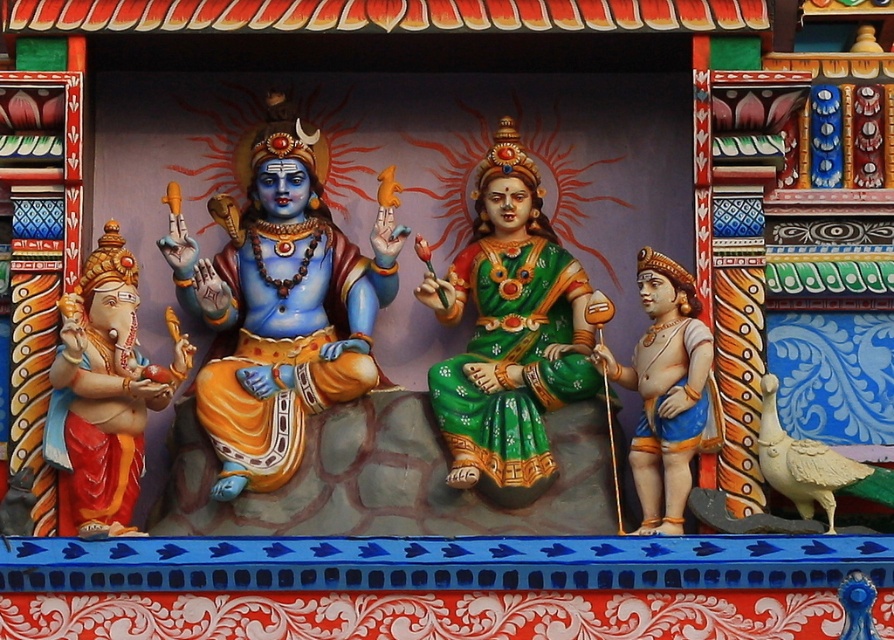
Find the location of a particular element. This screenshot has width=894, height=640. green satin dress at center is located at coordinates (509, 333).

Does point (471, 413) come closer to viewer compared to point (658, 314)?

That is True.

Locate an element on the screen. Image resolution: width=894 pixels, height=640 pixels. green satin dress at center is located at coordinates 509,333.

Between matte blue statue at center and matte gold statue at right, which one is positioned higher?

matte blue statue at center is higher up.

Can you confirm if matte blue statue at center is taller than matte gold statue at right?

Indeed, matte blue statue at center has a greater height compared to matte gold statue at right.

Is point (368, 316) positioned before point (646, 339)?

That is False.

At what (x,y) coordinates should I click in order to perform the action: click on matte blue statue at center. Please return your answer as a coordinate pair (x, y). Looking at the image, I should click on (281, 304).

Does matte blue statue at center have a greater width compared to green satin dress at center?

Correct, the width of matte blue statue at center exceeds that of green satin dress at center.

Between matte blue statue at center and green satin dress at center, which one has more height?

matte blue statue at center is taller.

Is point (266, 465) behind point (528, 488)?

Yes.

Image resolution: width=894 pixels, height=640 pixels. I want to click on matte blue statue at center, so pyautogui.click(x=281, y=304).